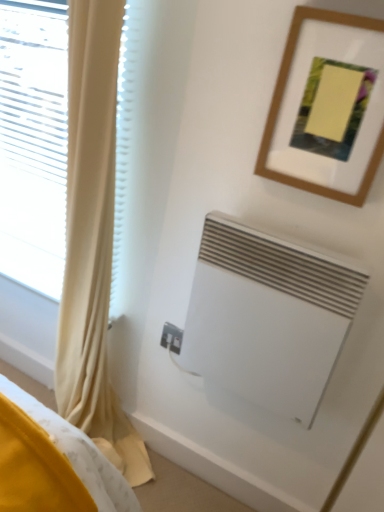
The height and width of the screenshot is (512, 384). What do you see at coordinates (93, 240) in the screenshot?
I see `yellow fabric curtain at left` at bounding box center [93, 240].

The width and height of the screenshot is (384, 512). Describe the element at coordinates (268, 317) in the screenshot. I see `white matte air conditioning at lower right` at that location.

Describe the element at coordinates (171, 337) in the screenshot. This screenshot has width=384, height=512. I see `white plastic electric outlet at lower center` at that location.

Where is `wooden picture frame at upper right`? The image size is (384, 512). wooden picture frame at upper right is located at coordinates (281, 100).

From a real-world perspective, is white plastic electric outlet at lower center positioned over white matte air conditioning at lower right based on gravity?

Actually, white plastic electric outlet at lower center is physically below white matte air conditioning at lower right in the real world.

Is white plastic electric outlet at lower center positioned before white matte air conditioning at lower right?

No.

Is white plastic electric outlet at lower center placed right next to white matte air conditioning at lower right?

No, white plastic electric outlet at lower center is not touching white matte air conditioning at lower right.

Does white plastic electric outlet at lower center have a lesser height compared to white matte air conditioning at lower right?

Yes.

Is yellow fabric curtain at left situated inside white plastic electric outlet at lower center or outside?

yellow fabric curtain at left is outside white plastic electric outlet at lower center.

Is yellow fabric curtain at left far from white plastic electric outlet at lower center?

No, yellow fabric curtain at left is in close proximity to white plastic electric outlet at lower center.

Can you confirm if yellow fabric curtain at left is smaller than white plastic electric outlet at lower center?

No, yellow fabric curtain at left is not smaller than white plastic electric outlet at lower center.

Looking at this image, from a real-world perspective, is yellow fabric curtain at left positioned above or below white plastic electric outlet at lower center?

From a real-world perspective, yellow fabric curtain at left is physically above white plastic electric outlet at lower center.

I want to click on picture frame above the white matte air conditioning at lower right (from a real-world perspective), so click(281, 100).

From the image's perspective, between wooden picture frame at upper right and white matte air conditioning at lower right, which one is located above?

wooden picture frame at upper right appears higher in the image.

Is wooden picture frame at upper right not near white matte air conditioning at lower right?

No.

Considering the sizes of wooden picture frame at upper right and white matte air conditioning at lower right in the image, is wooden picture frame at upper right taller or shorter than white matte air conditioning at lower right?

Clearly, wooden picture frame at upper right is shorter compared to white matte air conditioning at lower right.

Is yellow fabric curtain at left situated inside white matte air conditioning at lower right or outside?

yellow fabric curtain at left cannot be found inside white matte air conditioning at lower right.

Image resolution: width=384 pixels, height=512 pixels. I want to click on air conditioning located behind the yellow fabric curtain at left, so click(x=268, y=317).

Consider the image. Between yellow fabric curtain at left and white matte air conditioning at lower right, which one appears on the left side from the viewer's perspective?

From the viewer's perspective, yellow fabric curtain at left appears more on the left side.

Could yellow fabric curtain at left be considered to be inside wooden picture frame at upper right?

No, wooden picture frame at upper right does not contain yellow fabric curtain at left.

How many degrees apart are the facing directions of wooden picture frame at upper right and yellow fabric curtain at left?

0.0004 degrees.

Between wooden picture frame at upper right and yellow fabric curtain at left, which one is positioned in front?

yellow fabric curtain at left is closer to the camera.

Which is more to the left, wooden picture frame at upper right or yellow fabric curtain at left?

Positioned to the left is yellow fabric curtain at left.

Considering the relative positions of white plastic electric outlet at lower center and yellow fabric curtain at left in the image provided, is white plastic electric outlet at lower center to the left of yellow fabric curtain at left from the viewer's perspective?

Incorrect, white plastic electric outlet at lower center is not on the left side of yellow fabric curtain at left.

How much distance is there between white plastic electric outlet at lower center and yellow fabric curtain at left?

white plastic electric outlet at lower center is 14.87 inches from yellow fabric curtain at left.

Who is bigger, white plastic electric outlet at lower center or yellow fabric curtain at left?

yellow fabric curtain at left is bigger.

From a real-world perspective, relative to yellow fabric curtain at left, is white plastic electric outlet at lower center vertically above or below?

white plastic electric outlet at lower center is below yellow fabric curtain at left.

Considering the sizes of objects white matte air conditioning at lower right and wooden picture frame at upper right in the image provided, who is wider, white matte air conditioning at lower right or wooden picture frame at upper right?

Wider between the two is white matte air conditioning at lower right.

Could you tell me if white matte air conditioning at lower right is facing wooden picture frame at upper right?

No, white matte air conditioning at lower right is not facing towards wooden picture frame at upper right.

Based on their positions, is white matte air conditioning at lower right located to the left or right of wooden picture frame at upper right?

white matte air conditioning at lower right is positioned on wooden picture frame at upper right's left side.

From the image's perspective, who appears lower, white matte air conditioning at lower right or wooden picture frame at upper right?

white matte air conditioning at lower right.

Locate an element on the screen. air conditioning in front of the white plastic electric outlet at lower center is located at coordinates (268, 317).

Image resolution: width=384 pixels, height=512 pixels. In order to click on electric outlet on the right of yellow fabric curtain at left in this screenshot , I will do `click(171, 337)`.

Based on their spatial positions, is wooden picture frame at upper right or yellow fabric curtain at left closer to white plastic electric outlet at lower center?

Based on the image, yellow fabric curtain at left appears to be nearer to white plastic electric outlet at lower center.

Based on their spatial positions, is wooden picture frame at upper right or white matte air conditioning at lower right closer to yellow fabric curtain at left?

white matte air conditioning at lower right lies closer to yellow fabric curtain at left than the other object.

Which object lies further to the anchor point white matte air conditioning at lower right, yellow fabric curtain at left or wooden picture frame at upper right?

Among the two, yellow fabric curtain at left is located further to white matte air conditioning at lower right.

Considering their positions, is yellow fabric curtain at left positioned further to white plastic electric outlet at lower center than wooden picture frame at upper right?

wooden picture frame at upper right lies further to white plastic electric outlet at lower center than the other object.

Based on their spatial positions, is white plastic electric outlet at lower center or white matte air conditioning at lower right further from yellow fabric curtain at left?

Among the two, white matte air conditioning at lower right is located further to yellow fabric curtain at left.

Estimate the real-world distances between objects in this image. Which object is further from white matte air conditioning at lower right, white plastic electric outlet at lower center or wooden picture frame at upper right?

white plastic electric outlet at lower center.

Which object lies further to the anchor point white plastic electric outlet at lower center, wooden picture frame at upper right or white matte air conditioning at lower right?

wooden picture frame at upper right is positioned further to the anchor white plastic electric outlet at lower center.

Based on the photo, considering their positions, is white plastic electric outlet at lower center positioned closer to yellow fabric curtain at left than wooden picture frame at upper right?

white plastic electric outlet at lower center lies closer to yellow fabric curtain at left than the other object.

The height and width of the screenshot is (512, 384). In order to click on air conditioning between yellow fabric curtain at left and white plastic electric outlet at lower center in the front-back direction in this screenshot , I will do `click(268, 317)`.

At what (x,y) coordinates should I click in order to perform the action: click on air conditioning between wooden picture frame at upper right and white plastic electric outlet at lower center from top to bottom. Please return your answer as a coordinate pair (x, y). The width and height of the screenshot is (384, 512). Looking at the image, I should click on (268, 317).

The height and width of the screenshot is (512, 384). In order to click on air conditioning between yellow fabric curtain at left and wooden picture frame at upper right in the horizontal direction in this screenshot , I will do `click(268, 317)`.

The image size is (384, 512). Identify the location of picture frame positioned between yellow fabric curtain at left and white plastic electric outlet at lower center from near to far. (281, 100).